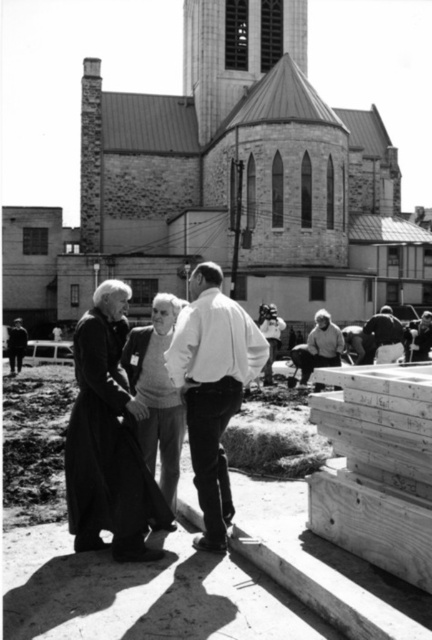
Question: Is stone church at center wider than dark gray fabric jacket at lower right?

Choices:
 (A) yes
 (B) no

Answer: (A)

Question: Which object is farther from the camera taking this photo?

Choices:
 (A) dark gray fabric jacket at lower right
 (B) white matte shirt at center
 (C) stone church at center

Answer: (C)

Question: In this image, where is stone church at center located relative to dark gray fabric jacket at lower right?

Choices:
 (A) right
 (B) left

Answer: (B)

Question: Estimate the real-world distances between objects in this image. Which object is closer to the white matte shirt at center?

Choices:
 (A) dark gray fabric jacket at lower right
 (B) stone church at center

Answer: (A)

Question: Considering the relative positions of white matte shirt at center and dark gray fabric jacket at lower right in the image provided, where is white matte shirt at center located with respect to dark gray fabric jacket at lower right?

Choices:
 (A) left
 (B) right

Answer: (A)

Question: Among these objects, which one is farthest from the camera?

Choices:
 (A) dark gray fabric jacket at lower right
 (B) white matte shirt at center
 (C) stone church at center

Answer: (C)